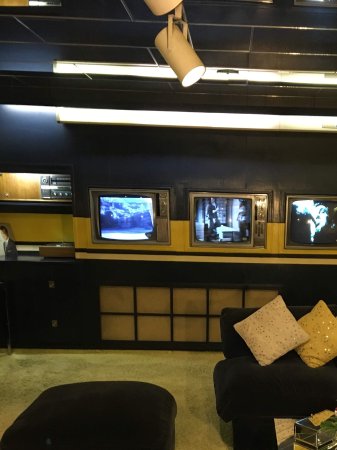
Where is `drawer pull`? drawer pull is located at coordinates (52, 283), (54, 323).